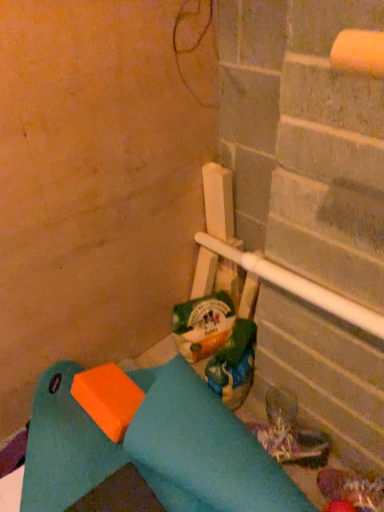
Question: Should I look upward or downward to see leather-like brown boot at lower right?

Choices:
 (A) up
 (B) down

Answer: (B)

Question: From the image's perspective, is green plastic bag at center on leather-like brown boot at lower right?

Choices:
 (A) no
 (B) yes

Answer: (B)

Question: Can you confirm if green plastic bag at center is shorter than leather-like brown boot at lower right?

Choices:
 (A) yes
 (B) no

Answer: (B)

Question: Is leather-like brown boot at lower right surrounded by green plastic bag at center?

Choices:
 (A) no
 (B) yes

Answer: (A)

Question: Is the position of green plastic bag at center less distant than that of leather-like brown boot at lower right?

Choices:
 (A) yes
 (B) no

Answer: (B)

Question: From a real-world perspective, is green plastic bag at center positioned under leather-like brown boot at lower right based on gravity?

Choices:
 (A) yes
 (B) no

Answer: (B)

Question: Is green plastic bag at center facing away from leather-like brown boot at lower right?

Choices:
 (A) yes
 (B) no

Answer: (B)

Question: From the image's perspective, would you say leather-like brown boot at lower right is shown under green plastic bag at center?

Choices:
 (A) no
 (B) yes

Answer: (B)

Question: Does leather-like brown boot at lower right come behind green plastic bag at center?

Choices:
 (A) no
 (B) yes

Answer: (A)

Question: Is the depth of leather-like brown boot at lower right less than that of green plastic bag at center?

Choices:
 (A) yes
 (B) no

Answer: (A)

Question: Is leather-like brown boot at lower right with green plastic bag at center?

Choices:
 (A) yes
 (B) no

Answer: (B)

Question: From the image's perspective, is leather-like brown boot at lower right located above green plastic bag at center?

Choices:
 (A) yes
 (B) no

Answer: (B)

Question: From a real-world perspective, is leather-like brown boot at lower right under green plastic bag at center?

Choices:
 (A) yes
 (B) no

Answer: (A)

Question: Which is correct: leather-like brown boot at lower right is inside green plastic bag at center, or outside of it?

Choices:
 (A) outside
 (B) inside

Answer: (A)